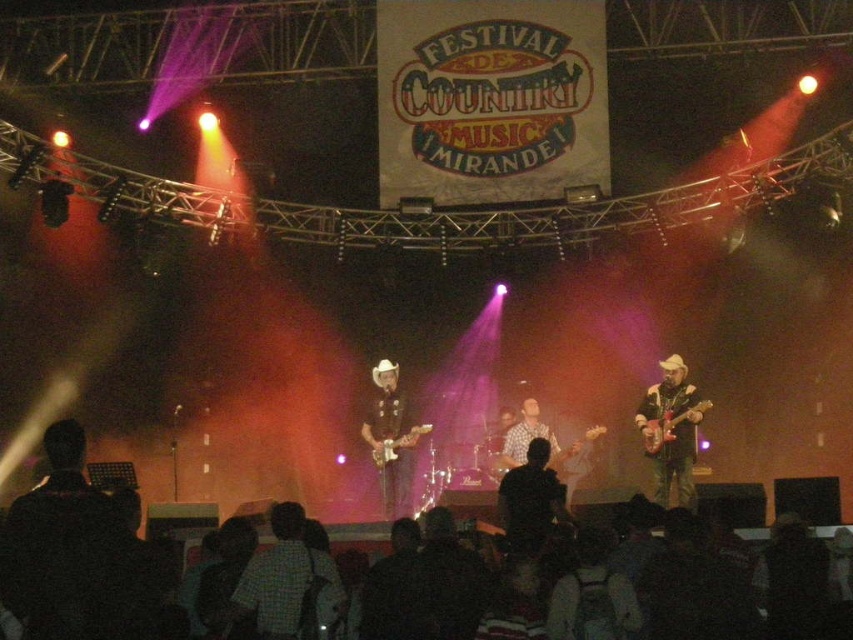
Does point (405, 444) come in front of point (587, 432)?

Yes.

Does shiny silver guitar at center have a lesser height compared to wooden acoustic guitar at center?

Incorrect, shiny silver guitar at center's height does not fall short of wooden acoustic guitar at center's.

Which is behind, point (387, 492) or point (560, 449)?

Point (560, 449)

Find the location of `shiny silver guitar at center`. shiny silver guitar at center is located at coordinates (392, 440).

Is shiny brown guitar at right thinner than shiny silver guitar at center?

Indeed, shiny brown guitar at right has a lesser width compared to shiny silver guitar at center.

Describe the element at coordinates (671, 429) in the screenshot. This screenshot has height=640, width=853. I see `shiny brown guitar at right` at that location.

Is point (669, 472) in front of point (413, 440)?

Yes, it is.

This screenshot has width=853, height=640. In order to click on shiny brown guitar at right in this screenshot , I will do [x=671, y=429].

Between shiny brown guitar at right and glossy wood guitar at center-right, which one has more height?

shiny brown guitar at right

At what (x,y) coordinates should I click in order to perform the action: click on shiny brown guitar at right. Please return your answer as a coordinate pair (x, y). The width and height of the screenshot is (853, 640). Looking at the image, I should click on (671, 429).

Find the location of `shiny brown guitar at right`. shiny brown guitar at right is located at coordinates (671, 429).

At what (x,y) coordinates should I click in order to perform the action: click on shiny brown guitar at right. Please return your answer as a coordinate pair (x, y). Looking at the image, I should click on (671, 429).